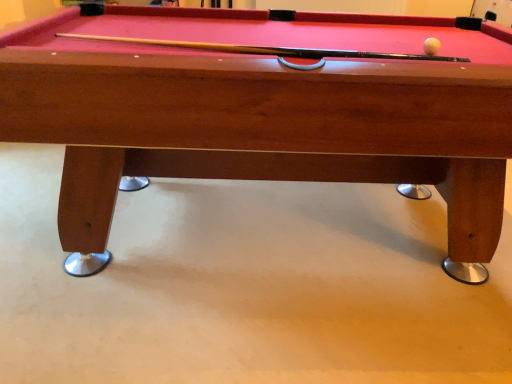
Question: Is white glossy ball at upper right facing away from wooden billiard table at center?

Choices:
 (A) no
 (B) yes

Answer: (B)

Question: Can we say white glossy ball at upper right lies outside wooden billiard table at center?

Choices:
 (A) yes
 (B) no

Answer: (B)

Question: From a real-world perspective, is white glossy ball at upper right beneath wooden billiard table at center?

Choices:
 (A) yes
 (B) no

Answer: (B)

Question: Is white glossy ball at upper right smaller than wooden billiard table at center?

Choices:
 (A) no
 (B) yes

Answer: (B)

Question: Is white glossy ball at upper right at the left side of wooden billiard table at center?

Choices:
 (A) no
 (B) yes

Answer: (A)

Question: Can you confirm if white glossy ball at upper right is wider than wooden billiard table at center?

Choices:
 (A) no
 (B) yes

Answer: (A)

Question: Is wooden billiard table at center positioned with its back to white glossy ball at upper right?

Choices:
 (A) no
 (B) yes

Answer: (A)

Question: Is wooden billiard table at center taller than white glossy ball at upper right?

Choices:
 (A) no
 (B) yes

Answer: (B)

Question: Is wooden billiard table at center surrounding white glossy ball at upper right?

Choices:
 (A) yes
 (B) no

Answer: (A)

Question: Considering the relative sizes of wooden billiard table at center and white glossy ball at upper right in the image provided, is wooden billiard table at center smaller than white glossy ball at upper right?

Choices:
 (A) no
 (B) yes

Answer: (A)

Question: Is the position of wooden billiard table at center less distant than that of white glossy ball at upper right?

Choices:
 (A) yes
 (B) no

Answer: (A)

Question: Are wooden billiard table at center and white glossy ball at upper right far apart?

Choices:
 (A) no
 (B) yes

Answer: (A)

Question: Is wooden billiard table at center spatially inside white glossy ball at upper right, or outside of it?

Choices:
 (A) outside
 (B) inside

Answer: (A)